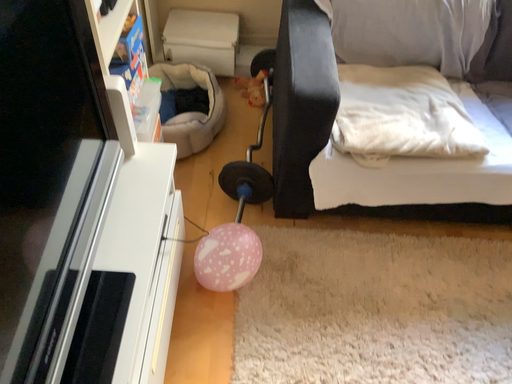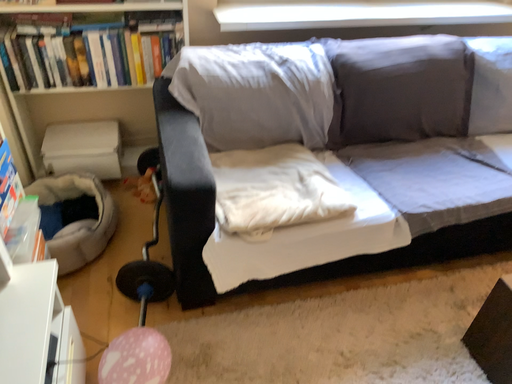
Question: How did the camera likely rotate when shooting the video?

Choices:
 (A) rotated left
 (B) rotated right

Answer: (B)